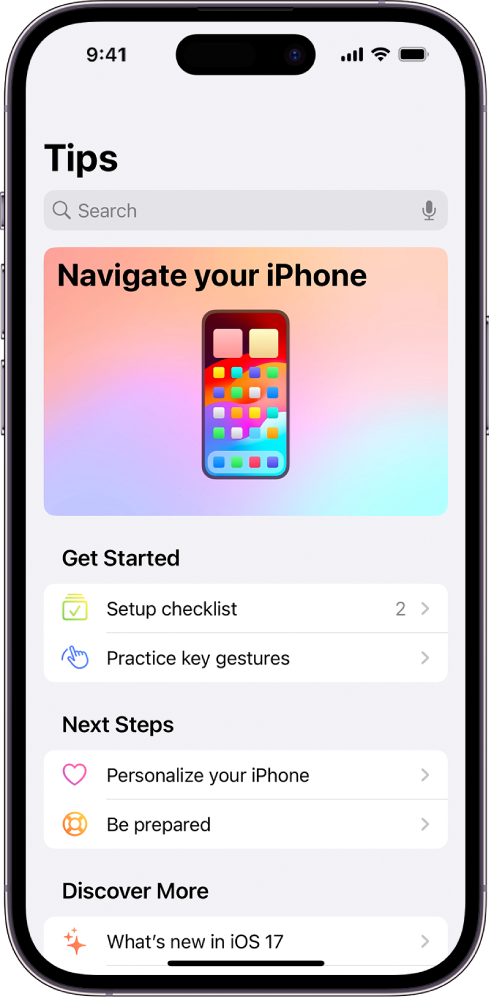
This screenshot has width=490, height=998. Identify the location of speaker. (430, 206).